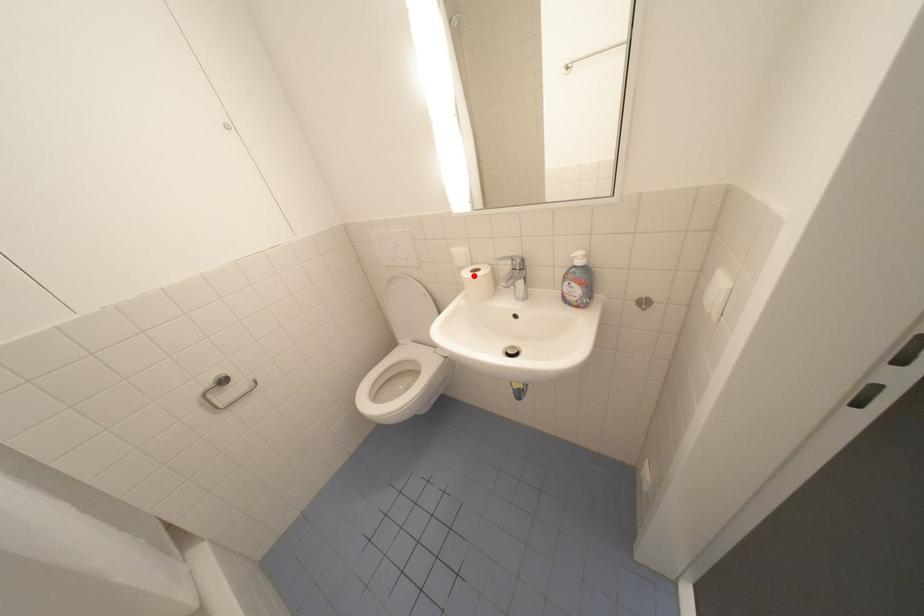
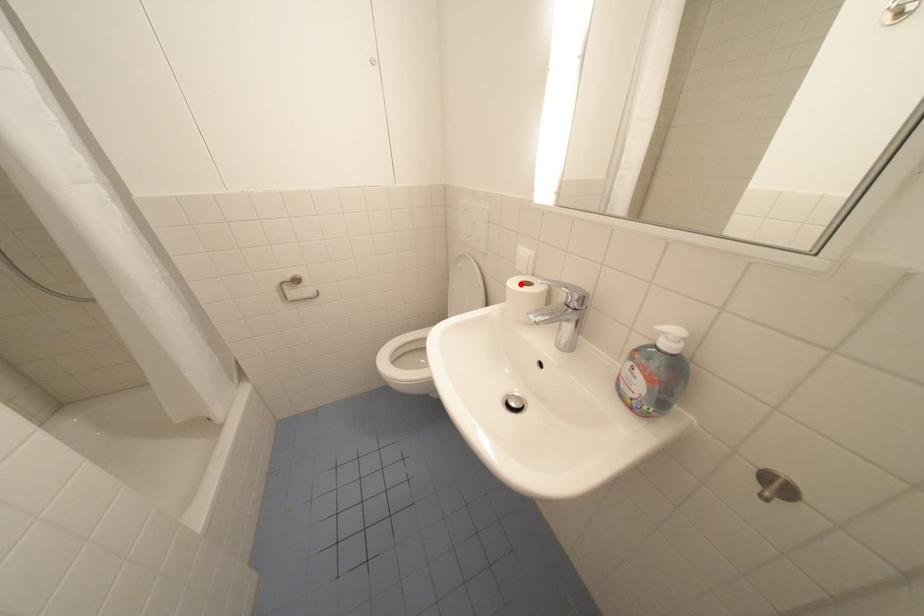
I am providing you with two images of the same scene from different viewpoints. A red point is marked on the first image and another point is marked on the second image. Is the marked point in image1 the same physical position as the marked point in image2?

Yes